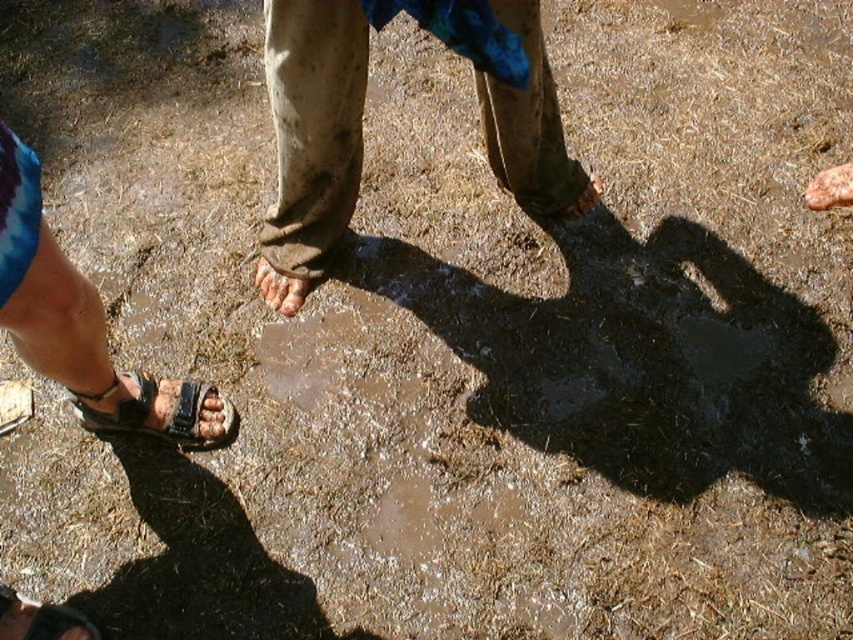
You are standing on the muddy ground and see the brown sandal at center and the brown leather toe at lower left. Which object is bigger in size?

The brown sandal at center is larger in size than the brown leather toe at lower left.

From the picture: You are standing on the muddy ground and see the brown sandal at center and the brown leather toe at lower left. Which object is closer to you?

The brown sandal at center is closer to you because it is further to the viewer than the brown leather toe at lower left.

Based on the photo, you are standing on the muddy ground and see the dirty beige pants at center and the brown leather toe at lower left. Which object is positioned more to the left side?

The brown leather toe at lower left is positioned more to the left side than the dirty beige pants at center.